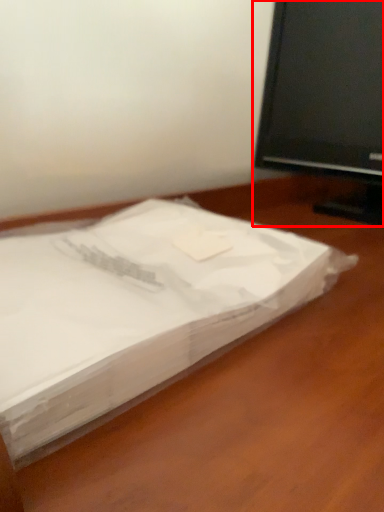
Question: From the image's perspective, where is television (annotated by the red box) located in relation to desk in the image?

Choices:
 (A) above
 (B) below

Answer: (A)